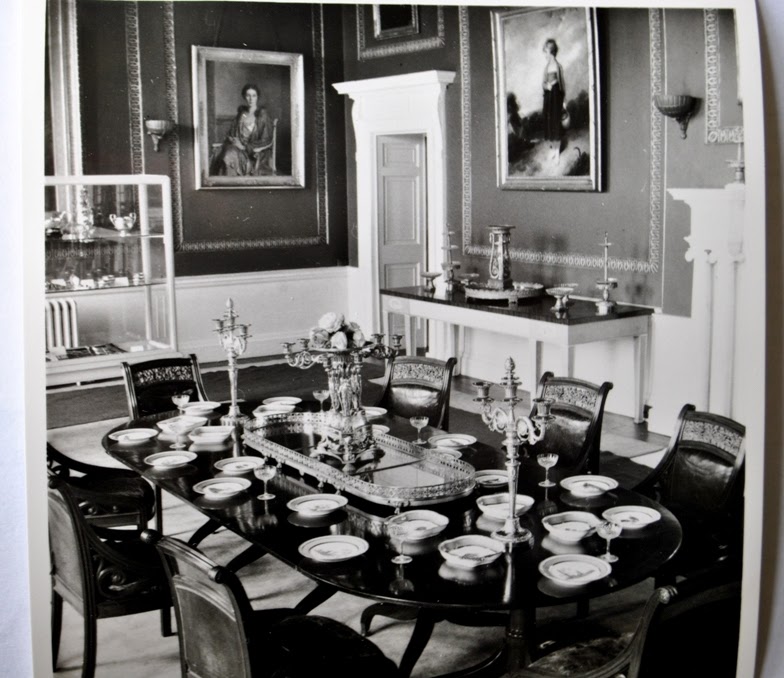
You are a GUI agent. You are given a task and a screenshot of the screen. Output one action in this format:
    pyautogui.click(x=<x>, y=<y>)
    Task: Click on the candlesticks
    Image resolution: width=784 pixels, height=678 pixels.
    Given the screenshot: What is the action you would take?
    pyautogui.click(x=507, y=443), pyautogui.click(x=229, y=340)